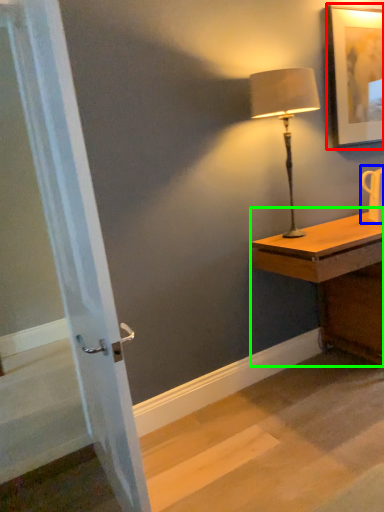
Question: Considering the real-world distances, which object is closest to picture frame (highlighted by a red box)? mug (highlighted by a blue box) or desk (highlighted by a green box).

Choices:
 (A) mug
 (B) desk

Answer: (A)